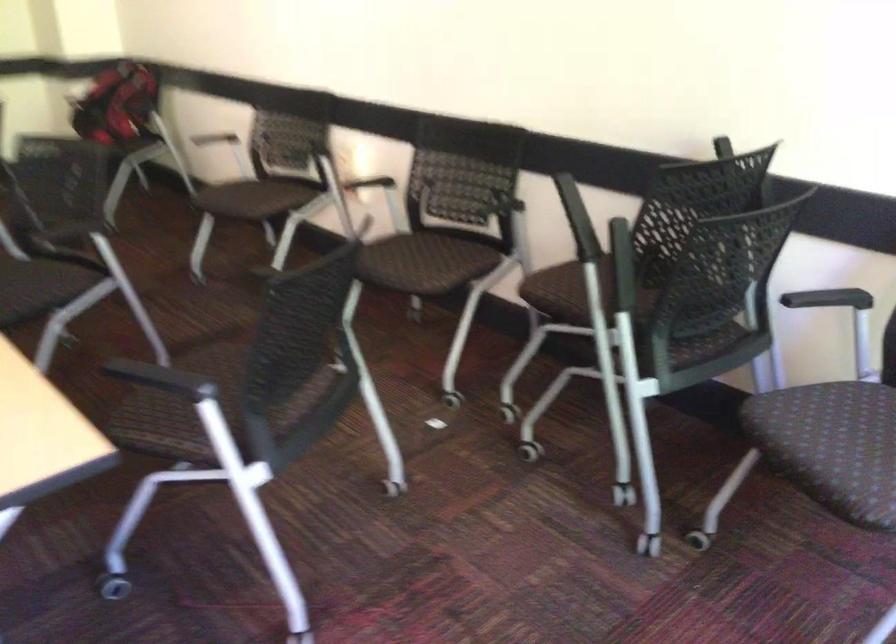
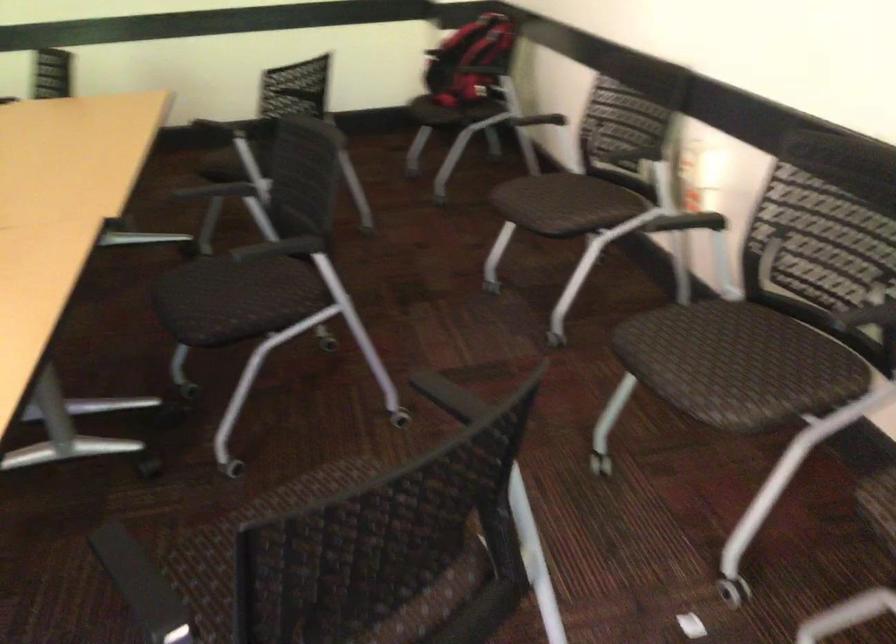
Find the pixel in the second image that matches the point at 274,194 in the first image.

(581, 207)